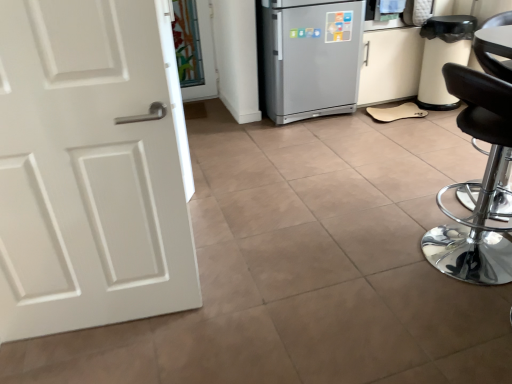
Question: Does white matte cabinet at right have a smaller size compared to transparent glass door at upper center?

Choices:
 (A) no
 (B) yes

Answer: (A)

Question: From a real-world perspective, is white matte cabinet at right located beneath transparent glass door at upper center?

Choices:
 (A) yes
 (B) no

Answer: (B)

Question: Is the depth of white matte cabinet at right less than that of transparent glass door at upper center?

Choices:
 (A) yes
 (B) no

Answer: (A)

Question: Are white matte cabinet at right and transparent glass door at upper center located far from each other?

Choices:
 (A) no
 (B) yes

Answer: (B)

Question: Is white matte cabinet at right surrounding transparent glass door at upper center?

Choices:
 (A) yes
 (B) no

Answer: (B)

Question: Would you say white matte cabinet at right is to the left or to the right of transparent glass door at upper center in the picture?

Choices:
 (A) left
 (B) right

Answer: (B)

Question: From a real-world perspective, is white matte cabinet at right positioned above or below transparent glass door at upper center?

Choices:
 (A) below
 (B) above

Answer: (B)

Question: Looking at their shapes, would you say white matte cabinet at right is wider or thinner than transparent glass door at upper center?

Choices:
 (A) wide
 (B) thin

Answer: (A)

Question: Is white matte cabinet at right inside or outside of transparent glass door at upper center?

Choices:
 (A) outside
 (B) inside

Answer: (A)

Question: Considering the positions of silver metallic refrigerator at center and white matte cabinet at right in the image, is silver metallic refrigerator at center wider or thinner than white matte cabinet at right?

Choices:
 (A) thin
 (B) wide

Answer: (B)

Question: Is point (289, 1) positioned closer to the camera than point (398, 84)?

Choices:
 (A) farther
 (B) closer

Answer: (B)

Question: From a real-world perspective, relative to white matte cabinet at right, is silver metallic refrigerator at center vertically above or below?

Choices:
 (A) below
 (B) above

Answer: (B)

Question: Looking at the image, does silver metallic refrigerator at center seem bigger or smaller compared to white matte cabinet at right?

Choices:
 (A) small
 (B) big

Answer: (B)

Question: Choose the correct answer: Is black leather stool at right inside transparent glass door at upper center or outside it?

Choices:
 (A) outside
 (B) inside

Answer: (A)

Question: Is black leather stool at right taller or shorter than transparent glass door at upper center?

Choices:
 (A) tall
 (B) short

Answer: (A)